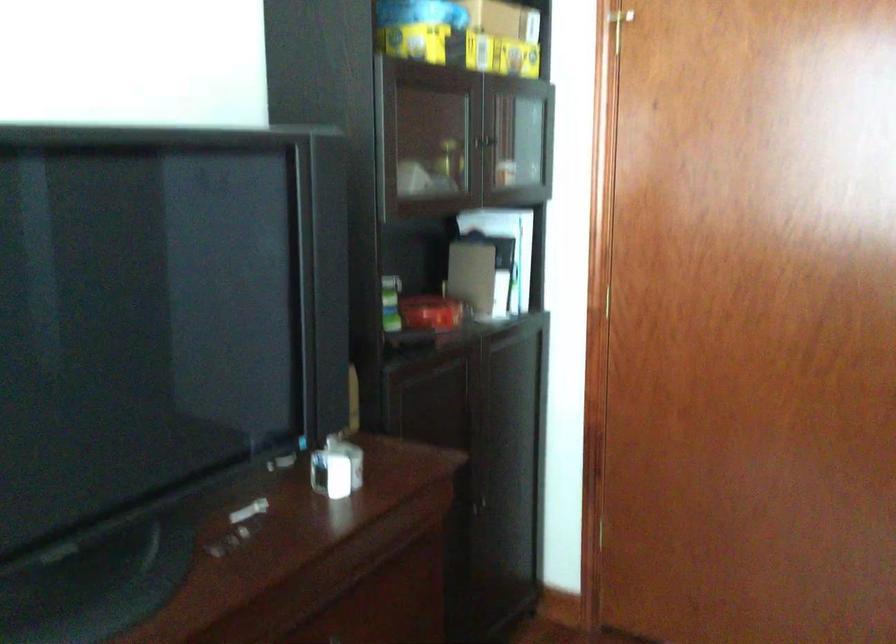
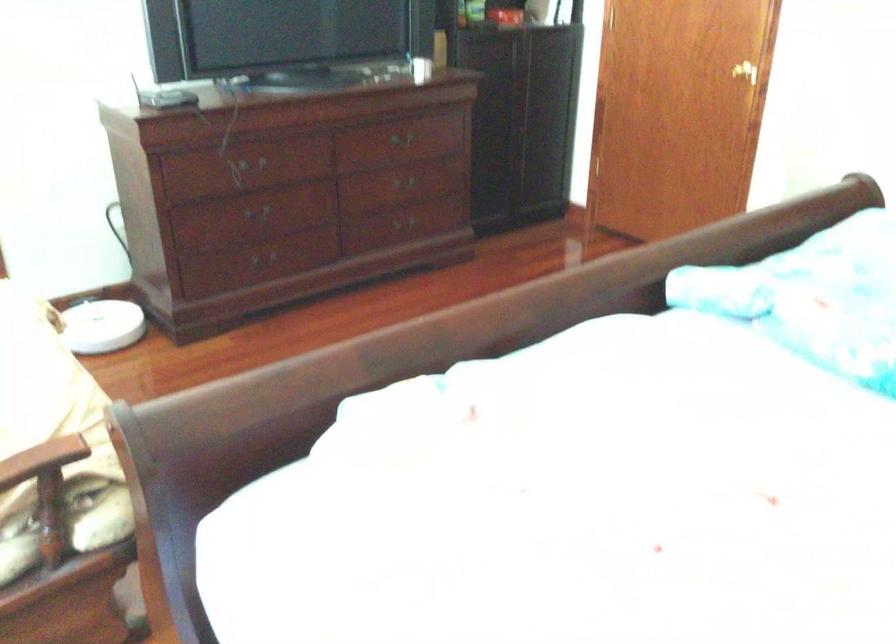
The images are taken continuously from a first-person perspective. In which direction are you moving?

The movement direction of the cameraman is right, backward.